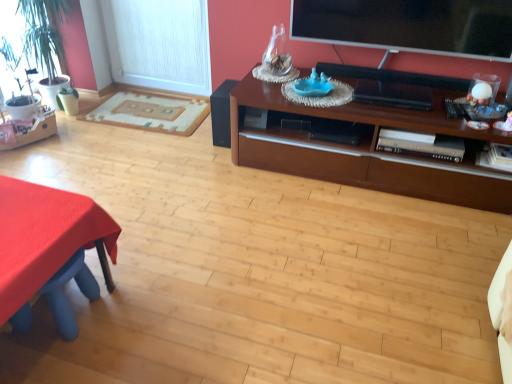
Image resolution: width=512 pixels, height=384 pixels. I want to click on free location in front of brown wood cabinet at upper right, so click(x=351, y=268).